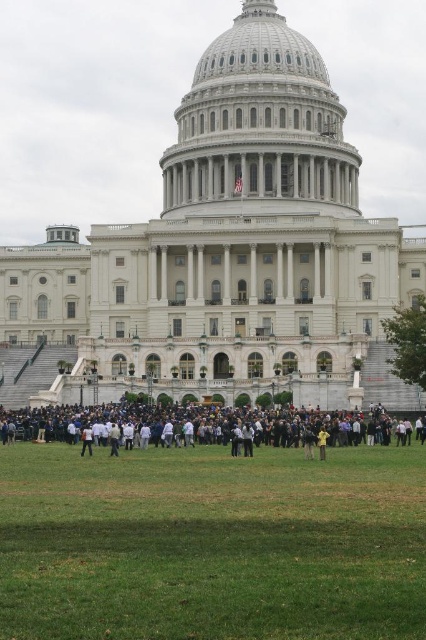
Question: Can you confirm if white marble dome at center is positioned to the right of dark gray clothing at center?

Choices:
 (A) no
 (B) yes

Answer: (B)

Question: Which object is positioned farthest from the green grass at lower center?

Choices:
 (A) dark gray clothing at center
 (B) yellow matte jacket at lower center
 (C) white marble dome at center

Answer: (C)

Question: Which point is farther to the camera?

Choices:
 (A) white cotton shirt at lower center
 (B) yellow matte jacket at lower center

Answer: (A)

Question: Can you confirm if green grass at lower center is positioned above yellow matte jacket at lower center?

Choices:
 (A) yes
 (B) no

Answer: (B)

Question: Considering the relative positions of green grass at lower center and yellow matte jacket at lower center in the image provided, where is green grass at lower center located with respect to yellow matte jacket at lower center?

Choices:
 (A) right
 (B) left

Answer: (B)

Question: Among these objects, which one is nearest to the camera?

Choices:
 (A) yellow matte jacket at lower center
 (B) white marble dome at center
 (C) dark gray clothing at center
 (D) white cotton shirt at lower center

Answer: (A)